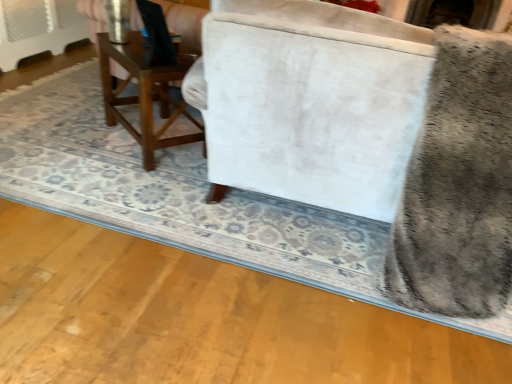
Question: From a real-world perspective, is wooden table at center physically above gray plush swivel chair at right?

Choices:
 (A) yes
 (B) no

Answer: (B)

Question: Is wooden table at center to the left of gray plush swivel chair at right from the viewer's perspective?

Choices:
 (A) yes
 (B) no

Answer: (A)

Question: Is gray plush swivel chair at right inside wooden table at center?

Choices:
 (A) no
 (B) yes

Answer: (A)

Question: Is wooden table at center completely or partially outside of gray plush swivel chair at right?

Choices:
 (A) yes
 (B) no

Answer: (A)

Question: Is wooden table at center positioned behind gray plush swivel chair at right?

Choices:
 (A) no
 (B) yes

Answer: (B)

Question: Can you confirm if wooden table at center is taller than gray plush swivel chair at right?

Choices:
 (A) no
 (B) yes

Answer: (A)

Question: From the image's perspective, does gray plush swivel chair at right appear higher than wooden table at center?

Choices:
 (A) yes
 (B) no

Answer: (B)

Question: From the image's perspective, is gray plush swivel chair at right under wooden table at center?

Choices:
 (A) yes
 (B) no

Answer: (A)

Question: Can you confirm if gray plush swivel chair at right is taller than wooden table at center?

Choices:
 (A) yes
 (B) no

Answer: (A)

Question: Can you confirm if gray plush swivel chair at right is shorter than wooden table at center?

Choices:
 (A) no
 (B) yes

Answer: (A)

Question: Is gray plush swivel chair at right not within wooden table at center?

Choices:
 (A) no
 (B) yes

Answer: (B)

Question: Would you say gray plush swivel chair at right contains wooden table at center?

Choices:
 (A) no
 (B) yes

Answer: (A)

Question: From the image's perspective, relative to wooden table at center, is gray plush swivel chair at right above or below?

Choices:
 (A) above
 (B) below

Answer: (B)